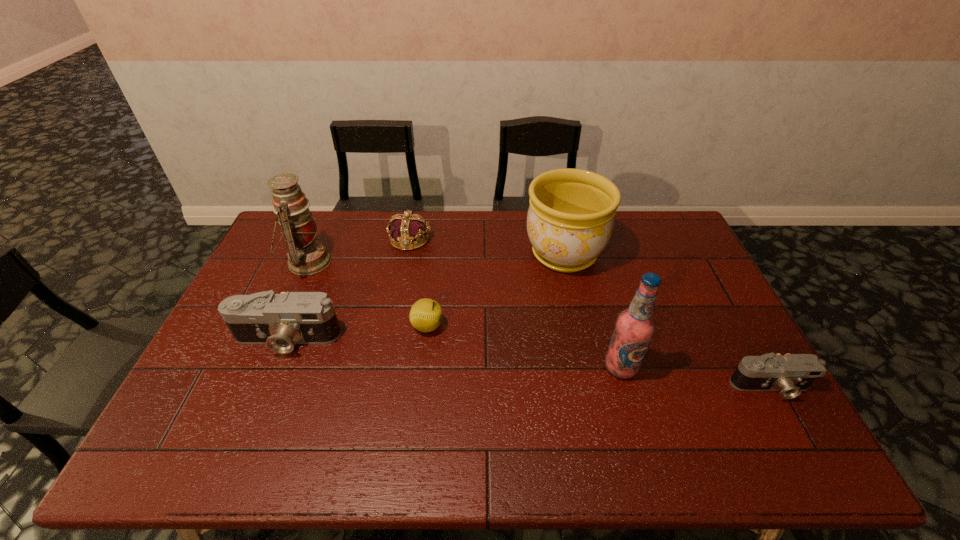
Where is `oil lamp that is positioned at the left edge`? The width and height of the screenshot is (960, 540). oil lamp that is positioned at the left edge is located at coordinates (306, 255).

Where is `object that is positioned at the right edge`? object that is positioned at the right edge is located at coordinates (790, 374).

Identify the location of object that is positioned at the far left corner. The height and width of the screenshot is (540, 960). (306, 255).

Where is `object that is at the near right corner`? This screenshot has width=960, height=540. object that is at the near right corner is located at coordinates (790, 374).

Identify the location of free space at the far edge of the desktop. The image size is (960, 540). (485, 232).

Identify the location of free space at the near edge of the desktop. This screenshot has height=540, width=960. (644, 402).

You are a GUI agent. You are given a task and a screenshot of the screen. Output one action in this format:
    pyautogui.click(x=<x>, y=<y>)
    Task: Click on the vacant space at the far left corner of the desktop
    The height and width of the screenshot is (540, 960).
    Given the screenshot: What is the action you would take?
    pyautogui.click(x=314, y=217)

Find the location of a particular element. The height and width of the screenshot is (540, 960). vacant space at the far right corner of the desktop is located at coordinates (660, 250).

Identify the location of empty location between the fourth shortest object and the nearer camera. This screenshot has width=960, height=540. click(x=529, y=363).

Image resolution: width=960 pixels, height=540 pixels. Find the location of `vacant point located between the fourth shortest object and the nearer camera`. vacant point located between the fourth shortest object and the nearer camera is located at coordinates (529, 363).